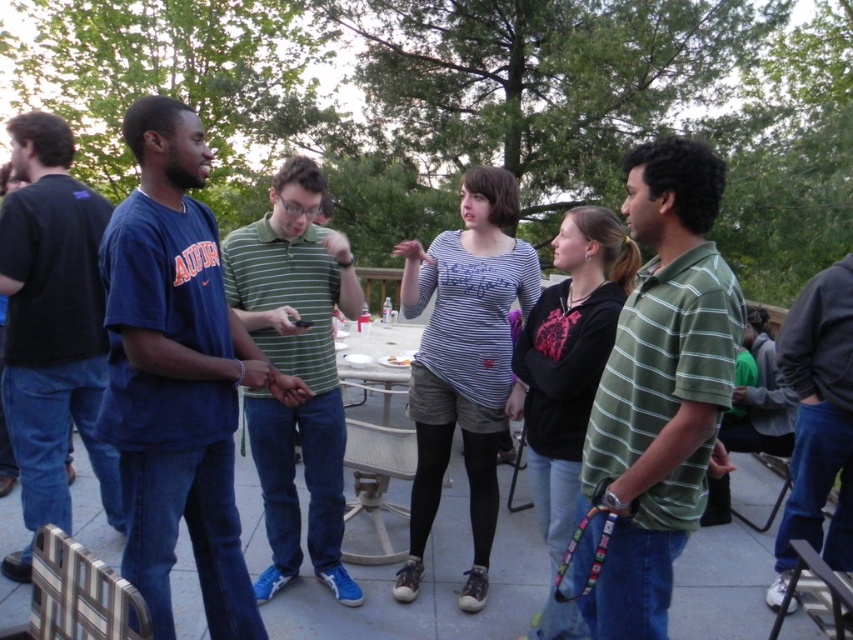
You are standing at the edge of the patio and want to place a small potted plant between the dark gray hoodie at right and the metallic silver table at center. Which object should you position the plant closer to if you want it to appear larger in the photo you take?

The dark gray hoodie at right is closer to the viewer than the metallic silver table at center. To make the plant appear larger in the photo, you should position it closer to the dark gray hoodie at right since objects closer to the camera appear bigger.

You are a photographer at this event and want to capture a clear photo of the dark gray hoodie at right without the green striped polo shirt at right blocking it. What should you do?

The green striped polo shirt at right is positioned over dark gray hoodie at right, so to avoid the polo shirt blocking the hoodie, you should adjust your angle or move closer to capture the hoodie from below or the side where the polo shirt is not covering it.

You are standing at the point with coordinates point (775, 547) and want to walk towards the point with coordinates point (396, 349). Which direction should you move relative to the other point?

You should move towards the point (396, 349), which is behind point (775, 547) since point (775, 547) is in front of point (396, 349).